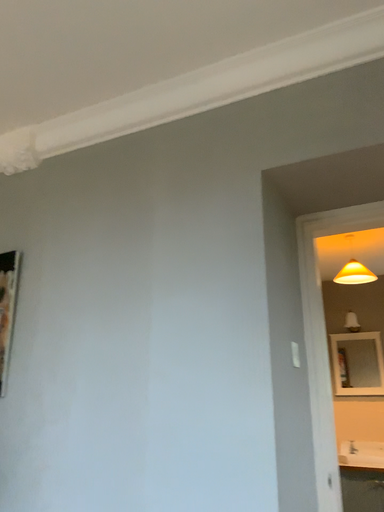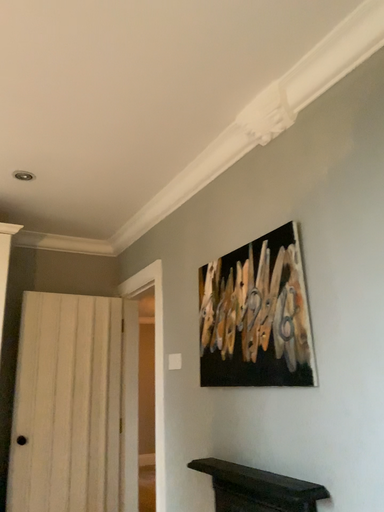
Question: Which way did the camera rotate in the video?

Choices:
 (A) rotated upward
 (B) rotated downward

Answer: (B)